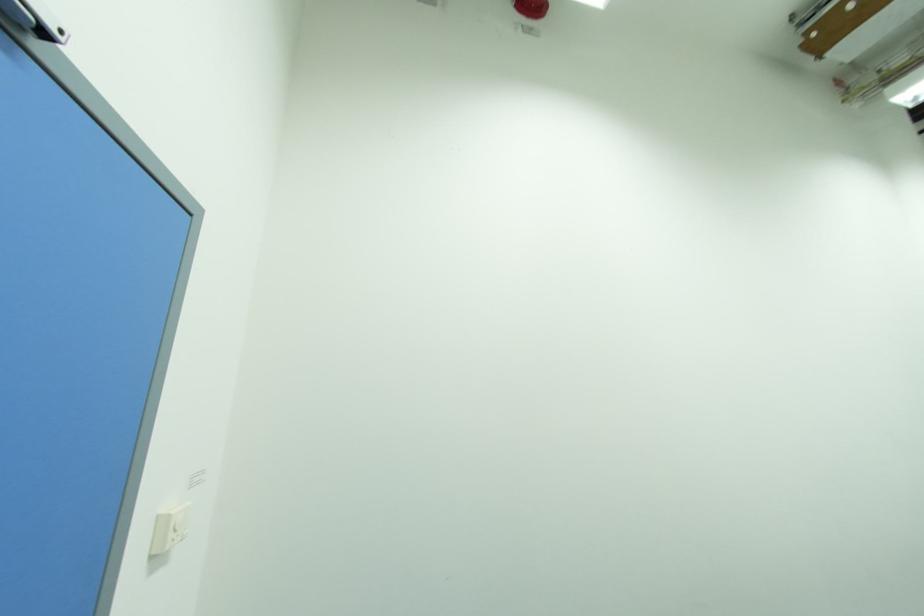
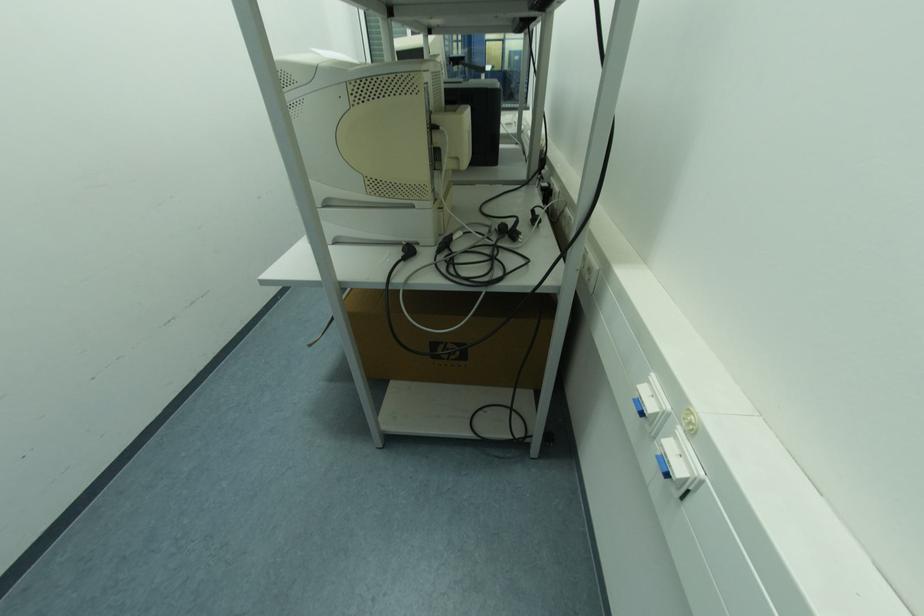
First-person continuous shooting, in which direction is the camera rotating?

The camera rotated toward right-down.